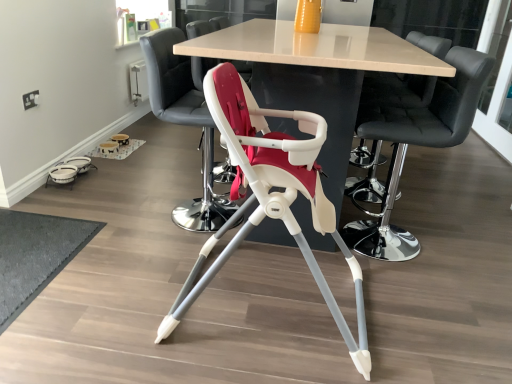
You are a GUI agent. You are given a task and a screenshot of the screen. Output one action in this format:
    pyautogui.click(x=<x>, y=<y>)
    Task: Click on the space that is in front of white plastic highchair at center, the 4th chair positioned from the right
    The width and height of the screenshot is (512, 384).
    Given the screenshot: What is the action you would take?
    pyautogui.click(x=165, y=253)